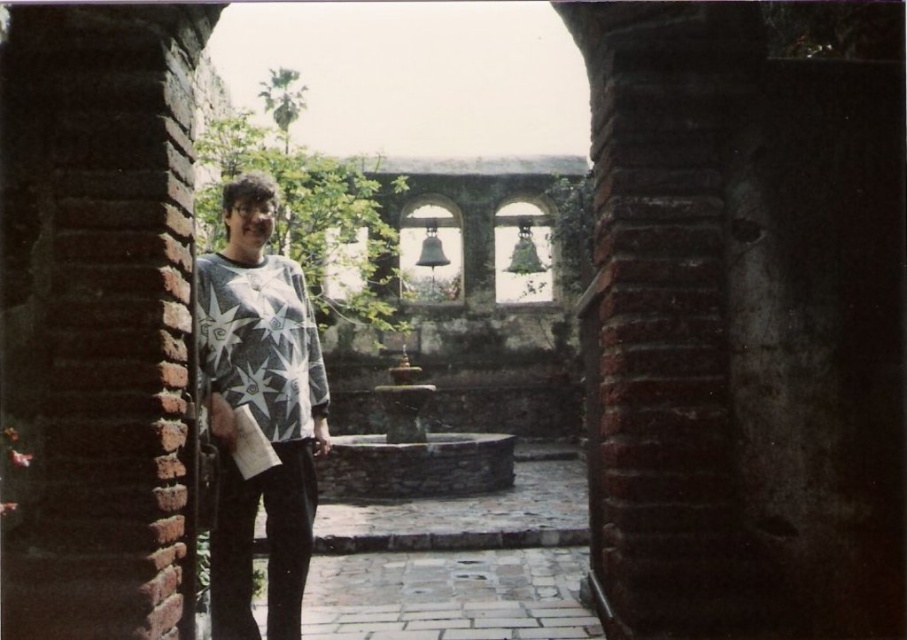
Question: Which point is farther to the camera?

Choices:
 (A) white printed sweater at center
 (B) white star-patterned sweater at center

Answer: (A)

Question: Can you confirm if white star-patterned sweater at center is positioned to the left of white printed sweater at center?

Choices:
 (A) no
 (B) yes

Answer: (B)

Question: Does white star-patterned sweater at center come in front of white printed sweater at center?

Choices:
 (A) no
 (B) yes

Answer: (B)

Question: Which point appears farthest from the camera in this image?

Choices:
 (A) (313, 403)
 (B) (225, 460)

Answer: (A)

Question: Is white star-patterned sweater at center above white printed sweater at center?

Choices:
 (A) no
 (B) yes

Answer: (A)